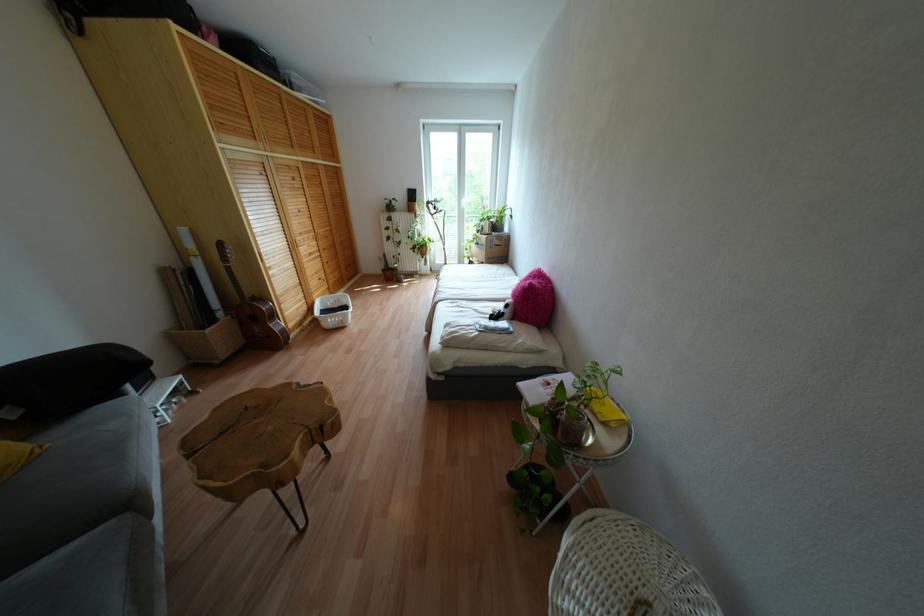
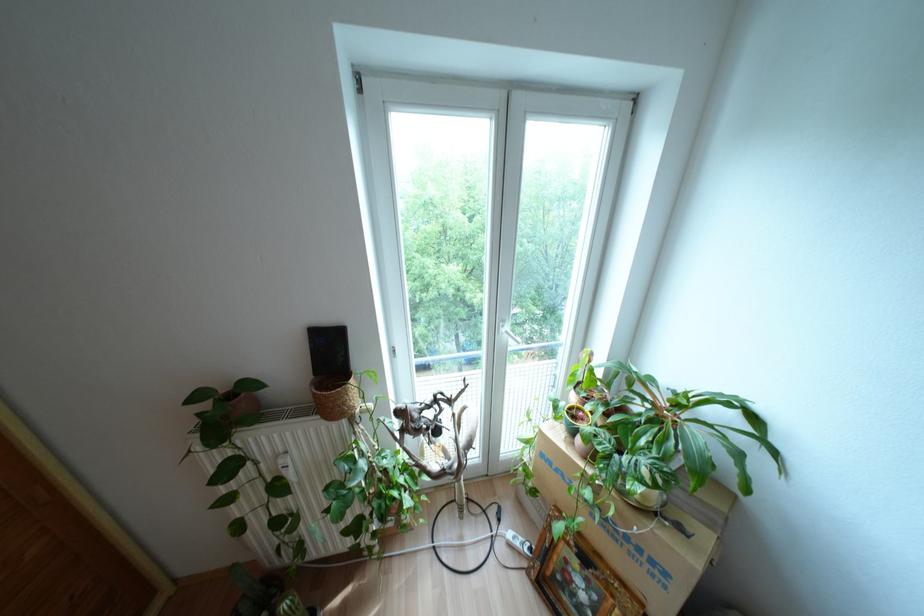
Question: In a continuous first-person perspective shot, in which direction is the camera moving?

Choices:
 (A) Left
 (B) Right
 (C) Forward
 (D) Backward

Answer: (C)